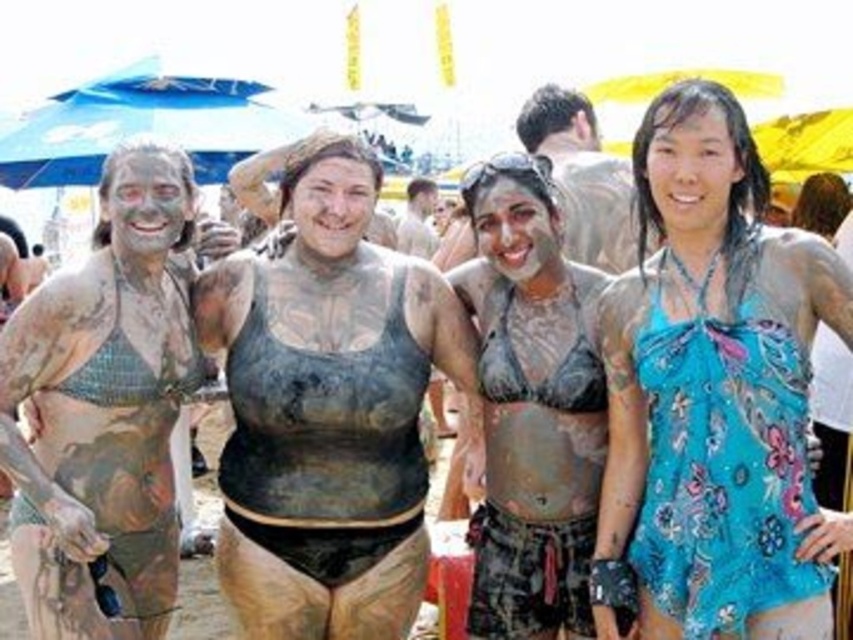
You are a photographer at the event and want to take a portrait of both the smooth skin face at center and the matte mud face at center. Which face should you focus on to ensure it appears larger in the photo?

The smooth skin face at center is taller than the matte mud face at center, so focusing on the smooth skin face at center will make it appear larger in the photo.

You are a photographer taking a picture of the blue floral dress at center and the smooth skin face at center. Which object is taller in the image?

The blue floral dress at center is taller than the smooth skin face at center.

You are a photographer at the beach event. You need to take a portrait of both the smooth skin face at center and the matte clay face at center. Which face should you focus on first if you want to capture both in a single shot without adjusting the camera focus? Explain your reasoning based on their positions.

The smooth skin face at center has a lesser height compared to the matte clay face at center. Since the smooth skin face is closer to the camera, focusing on it first would ensure both are in focus as the matte clay face is farther away. However, if the depth of field is sufficient, both might be captured clearly without adjustment.